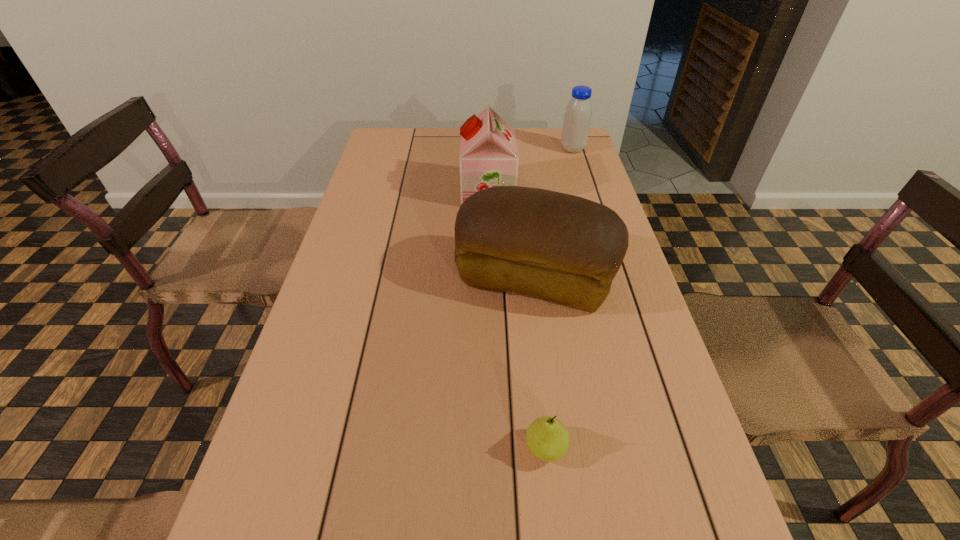
This screenshot has width=960, height=540. What are the coordinates of `free location located 0.250m on the left of the bread` in the screenshot? It's located at [x=353, y=279].

The width and height of the screenshot is (960, 540). What are the coordinates of `free space located on the front of the shorter soya milk` in the screenshot? It's located at pos(577,163).

Find the location of `vacant space located on the back of the shortest object`. vacant space located on the back of the shortest object is located at coordinates (539, 384).

This screenshot has width=960, height=540. I want to click on object present at the far edge, so click(577, 117).

Image resolution: width=960 pixels, height=540 pixels. Identify the location of bread present at the right edge. tap(558, 247).

Image resolution: width=960 pixels, height=540 pixels. What are the coordinates of `soya milk situated at the right edge` in the screenshot? It's located at (577, 117).

This screenshot has width=960, height=540. Identify the location of object that is positioned at the far right corner. (577, 117).

Identify the location of vacant space at the far edge of the desktop. (442, 150).

What are the coordinates of `vacant space at the left edge of the desktop` in the screenshot? It's located at (348, 417).

Locate an element on the screen. This screenshot has height=540, width=960. free location at the right edge is located at coordinates [x=625, y=287].